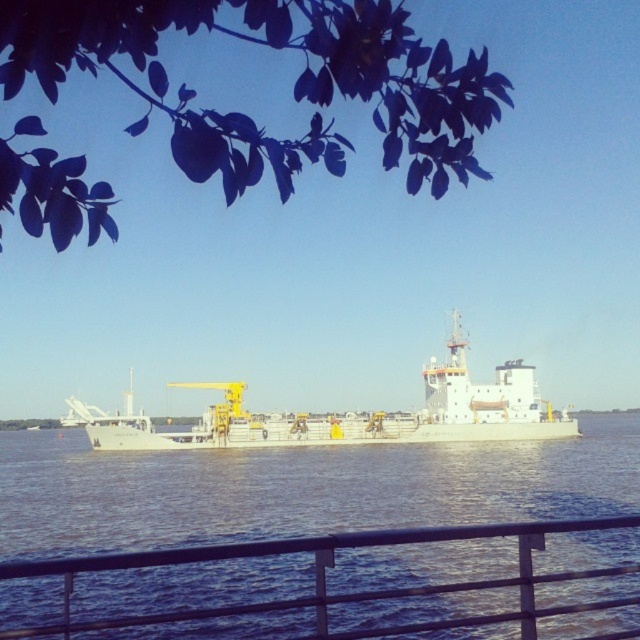
Question: Which object appears farthest from the camera in this image?

Choices:
 (A) dark green leaves at upper left
 (B) metal/rail at lower center
 (C) white matte ship at center

Answer: (C)

Question: Observing the image, what is the correct spatial positioning of dark green leaves at upper left in reference to white matte ship at center?

Choices:
 (A) right
 (B) left

Answer: (B)

Question: Which object is the farthest from the white matte ship at center?

Choices:
 (A) dark green leaves at upper left
 (B) metal/rail at lower center

Answer: (B)

Question: Does dark green leaves at upper left have a lesser width compared to white matte ship at center?

Choices:
 (A) no
 (B) yes

Answer: (B)

Question: Does white matte ship at center lie behind metal/rail at lower center?

Choices:
 (A) no
 (B) yes

Answer: (B)

Question: Which point is farther to the camera?

Choices:
 (A) (35, 195)
 (B) (314, 424)

Answer: (B)